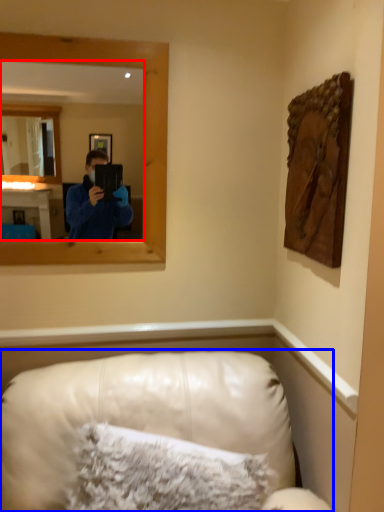
Question: Which of the following is the closest to the observer, mirror (highlighted by a red box) or furniture (highlighted by a blue box)?

Choices:
 (A) mirror
 (B) furniture

Answer: (B)